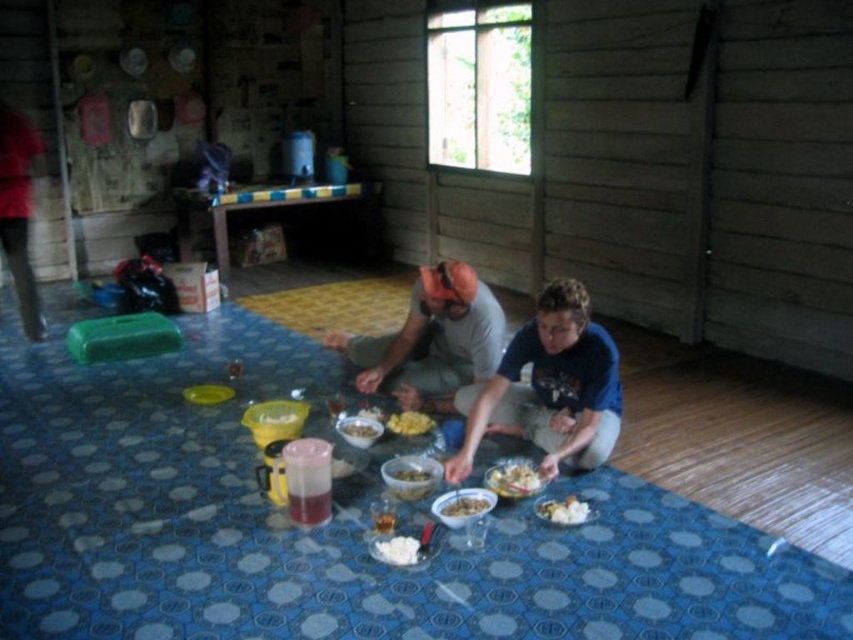
Consider the image. You are standing at the point labeled as point (416, 472) and want to move towards the point labeled as point (289, 417). Given that the blue mat is the only clear path between them, can you walk directly to the other point without stepping off the mat?

Yes, you can walk directly to point (289, 417) from point (416, 472) because the blue mat is the only clear path between them, and there are no obstacles mentioned in the scene description that would block the direct route.